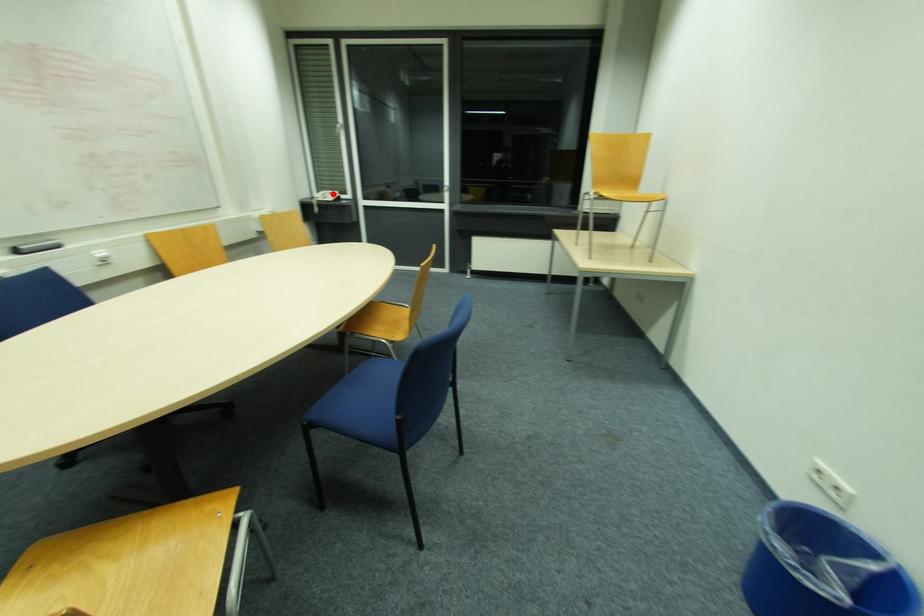
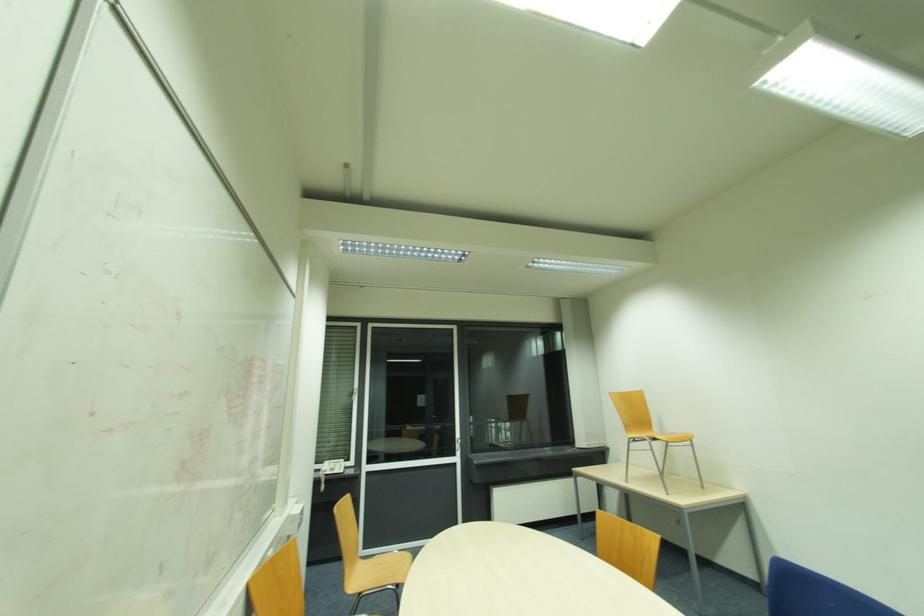
The point at the highlighted location is marked in the first image. Where is the corresponding point in the second image?

(334, 463)